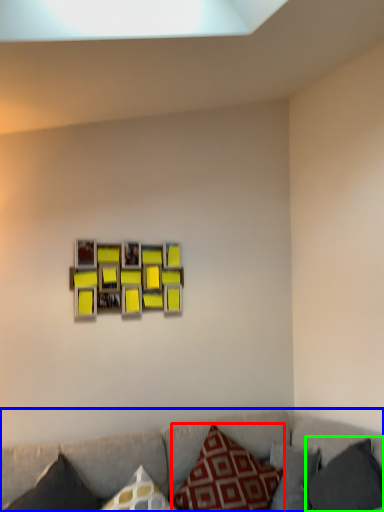
Question: Which object is positioned closest to pillow (highlighted by a red box)? Select from studio couch (highlighted by a blue box) and pillow (highlighted by a green box).

Choices:
 (A) studio couch
 (B) pillow

Answer: (A)